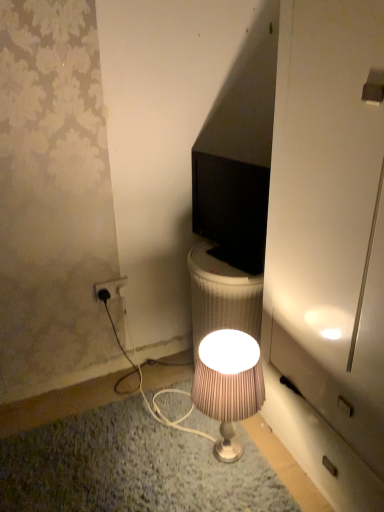
Question: Is silky beige lampshade at center facing towards white plastic power outlet at lower left?

Choices:
 (A) no
 (B) yes

Answer: (A)

Question: Does silky beige lampshade at center have a larger size compared to white plastic power outlet at lower left?

Choices:
 (A) no
 (B) yes

Answer: (B)

Question: Would you say white plastic power outlet at lower left is part of silky beige lampshade at center's contents?

Choices:
 (A) yes
 (B) no

Answer: (B)

Question: Considering the relative sizes of silky beige lampshade at center and white plastic power outlet at lower left in the image provided, is silky beige lampshade at center shorter than white plastic power outlet at lower left?

Choices:
 (A) no
 (B) yes

Answer: (A)

Question: Does silky beige lampshade at center have a lesser width compared to white plastic power outlet at lower left?

Choices:
 (A) yes
 (B) no

Answer: (B)

Question: Based on their sizes in the image, would you say white plastic power outlet at lower left is bigger or smaller than black glossy monitor at center?

Choices:
 (A) big
 (B) small

Answer: (B)

Question: Considering their positions, is white plastic power outlet at lower left located in front of or behind black glossy monitor at center?

Choices:
 (A) front
 (B) behind

Answer: (B)

Question: Considering the positions of white plastic power outlet at lower left and black glossy monitor at center in the image, is white plastic power outlet at lower left wider or thinner than black glossy monitor at center?

Choices:
 (A) wide
 (B) thin

Answer: (B)

Question: Would you say white plastic power outlet at lower left is inside or outside black glossy monitor at center?

Choices:
 (A) outside
 (B) inside

Answer: (A)

Question: From the image's perspective, is white plastic power outlet at lower left positioned above or below silky beige lampshade at center?

Choices:
 (A) below
 (B) above

Answer: (B)

Question: In terms of size, does white plastic power outlet at lower left appear bigger or smaller than silky beige lampshade at center?

Choices:
 (A) small
 (B) big

Answer: (A)

Question: Relative to silky beige lampshade at center, is white plastic power outlet at lower left in front or behind?

Choices:
 (A) front
 (B) behind

Answer: (B)

Question: From a real-world perspective, is white plastic power outlet at lower left positioned above or below silky beige lampshade at center?

Choices:
 (A) above
 (B) below

Answer: (A)

Question: From the image's perspective, is black glossy monitor at center positioned above or below white plastic power outlet at lower left?

Choices:
 (A) above
 (B) below

Answer: (A)

Question: Considering the positions of black glossy monitor at center and white plastic power outlet at lower left in the image, is black glossy monitor at center wider or thinner than white plastic power outlet at lower left?

Choices:
 (A) thin
 (B) wide

Answer: (B)